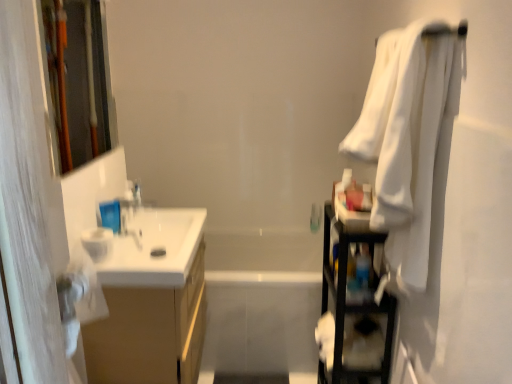
The image size is (512, 384). Describe the element at coordinates (131, 198) in the screenshot. I see `satin silver faucet at upper left` at that location.

At what (x,y) coordinates should I click in order to perform the action: click on white glossy bathtub at center. Please return your answer as a coordinate pair (x, y). The height and width of the screenshot is (384, 512). Looking at the image, I should click on (261, 321).

Where is `black plastic shelf at right`? This screenshot has width=512, height=384. black plastic shelf at right is located at coordinates (352, 305).

Based on the photo, in order to face black plastic shelf at right, should I rotate leftwards or rightwards?

Turn right approximately 13.313 degrees to face it.

This screenshot has width=512, height=384. Find the location of `white glossy sink at left`. white glossy sink at left is located at coordinates (154, 248).

Considering the relative sizes of satin silver faucet at upper left and clear plastic bottle at upper left in the image provided, is satin silver faucet at upper left thinner than clear plastic bottle at upper left?

No, satin silver faucet at upper left is not thinner than clear plastic bottle at upper left.

Which point is more forward, (131,200) or (135,181)?

The point (131,200) is in front.

From the image's perspective, is satin silver faucet at upper left above clear plastic bottle at upper left?

No, from the image's perspective, satin silver faucet at upper left is not above clear plastic bottle at upper left.

From the picture: Considering the relative sizes of wooden frame at left and satin silver faucet at upper left in the image provided, is wooden frame at left bigger than satin silver faucet at upper left?

Yes, wooden frame at left is bigger than satin silver faucet at upper left.

What's the angular difference between wooden frame at left and satin silver faucet at upper left's facing directions?

0.171 degrees.

Is wooden frame at left behind satin silver faucet at upper left?

No, wooden frame at left is in front of satin silver faucet at upper left.

From the image's perspective, relative to satin silver faucet at upper left, is wooden frame at left above or below?

From the image's perspective, wooden frame at left appears above satin silver faucet at upper left.

Consider the image. Which object is wider, clear plastic bottle at upper left or satin silver faucet at upper left?

satin silver faucet at upper left is wider.

Which is closer, [136,186] or [127,181]?

The point [127,181] is closer.

Consider the image. Considering the relative sizes of clear plastic bottle at upper left and satin silver faucet at upper left in the image provided, is clear plastic bottle at upper left shorter than satin silver faucet at upper left?

Indeed, clear plastic bottle at upper left has a lesser height compared to satin silver faucet at upper left.

Is clear plastic bottle at upper left oriented towards satin silver faucet at upper left?

No, clear plastic bottle at upper left does not turn towards satin silver faucet at upper left.

From the image's perspective, is white glossy bathtub at center located above or below wooden frame at left?

Clearly, from the image's perspective, white glossy bathtub at center is below wooden frame at left.

Based on the photo, considering the sizes of white glossy bathtub at center and wooden frame at left in the image, is white glossy bathtub at center taller or shorter than wooden frame at left?

white glossy bathtub at center is shorter than wooden frame at left.

In the image, is white glossy bathtub at center on the left side or the right side of wooden frame at left?

Clearly, white glossy bathtub at center is on the right of wooden frame at left in the image.

Considering the relative sizes of white glossy bathtub at center and wooden frame at left in the image provided, is white glossy bathtub at center smaller than wooden frame at left?

No, white glossy bathtub at center is not smaller than wooden frame at left.

In the scene shown: From a real-world perspective, is white glossy bathtub at center beneath white glossy sink at left?

Yes, from a real-world perspective, white glossy bathtub at center is below white glossy sink at left.

There is a white glossy bathtub at center. Identify the location of sink above it (from a real-world perspective). (154, 248).

Which is closer to the camera, (268, 274) or (135, 240)?

→ The point (135, 240) is closer to the camera.

How different are the orientations of white glossy bathtub at center and white glossy sink at left in degrees?

They differ by 89.5 degrees in their facing directions.

Which point is more distant from viewer, (337, 257) or (380, 157)?

The point (337, 257) is more distant.

From a real-world perspective, is black plastic shelf at right located beneath white soft towel at right?

Yes.

Locate an element on the screen. This screenshot has height=384, width=512. bath towel above the black plastic shelf at right (from the image's perspective) is located at coordinates (409, 137).

This screenshot has width=512, height=384. Find the location of `bath on the right of satin silver faucet at upper left`. bath on the right of satin silver faucet at upper left is located at coordinates (261, 321).

Is white glossy bathtub at center bigger than satin silver faucet at upper left?

Correct, white glossy bathtub at center is larger in size than satin silver faucet at upper left.

How many degrees apart are the facing directions of white glossy bathtub at center and satin silver faucet at upper left?

89.5 degrees separate the facing orientations of white glossy bathtub at center and satin silver faucet at upper left.

From the image's perspective, who appears lower, white glossy bathtub at center or satin silver faucet at upper left?

→ white glossy bathtub at center.

In order to click on faucet on the left of the clear plastic bottle at upper left in this screenshot , I will do `click(131, 198)`.

Locate an element on the screen. faucet lying below the wooden frame at left (from the image's perspective) is located at coordinates (131, 198).

When comparing their distances from white glossy bathtub at center, does wooden frame at left or white soft towel at right seem closer?

Among the two, white soft towel at right is located nearer to white glossy bathtub at center.

Based on their spatial positions, is black plastic shelf at right or matte wood cabinet at left closer to white soft towel at right?

Based on the image, black plastic shelf at right appears to be nearer to white soft towel at right.

From the image, which object appears to be farther from wooden frame at left, clear plastic bottle at upper left or white glossy bathtub at center?

Among the two, white glossy bathtub at center is located further to wooden frame at left.

From the image, which object appears to be nearer to clear plastic bottle at upper left, black plastic shelf at right or white soft towel at right?

black plastic shelf at right.

When comparing their distances from matte wood cabinet at left, does white glossy bathtub at center or black plastic shelf at right seem closer?

white glossy bathtub at center is positioned closer to the anchor matte wood cabinet at left.

Consider the image. When comparing their distances from white soft towel at right, does matte wood cabinet at left or white glossy bathtub at center seem closer?

matte wood cabinet at left is positioned closer to the anchor white soft towel at right.

Looking at the image, which one is located closer to matte wood cabinet at left, white glossy bathtub at center or white glossy sink at left?

Among the two, white glossy sink at left is located nearer to matte wood cabinet at left.

Based on their spatial positions, is white soft towel at right or white glossy sink at left further from white glossy bathtub at center?

white soft towel at right lies further to white glossy bathtub at center than the other object.

Locate an element on the screen. Image resolution: width=512 pixels, height=384 pixels. sink between white soft towel at right and white glossy bathtub at center along the z-axis is located at coordinates [x=154, y=248].

Identify the location of bath between wooden frame at left and white soft towel at right from left to right. This screenshot has width=512, height=384. (261, 321).

Locate an element on the screen. This screenshot has height=384, width=512. faucet between wooden frame at left and matte wood cabinet at left vertically is located at coordinates pyautogui.click(x=131, y=198).

Locate an element on the screen. sink that lies between wooden frame at left and matte wood cabinet at left from top to bottom is located at coordinates (154, 248).